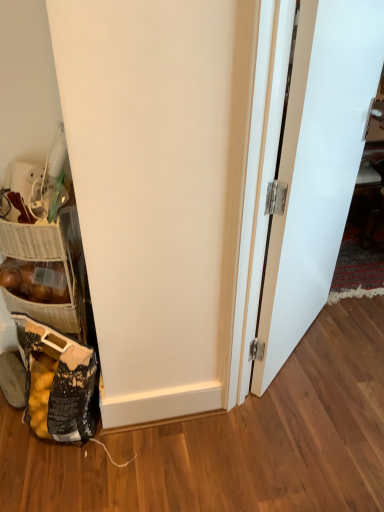
Where is `free spot in front of black plastic bag at lower left`? This screenshot has width=384, height=512. free spot in front of black plastic bag at lower left is located at coordinates (49, 479).